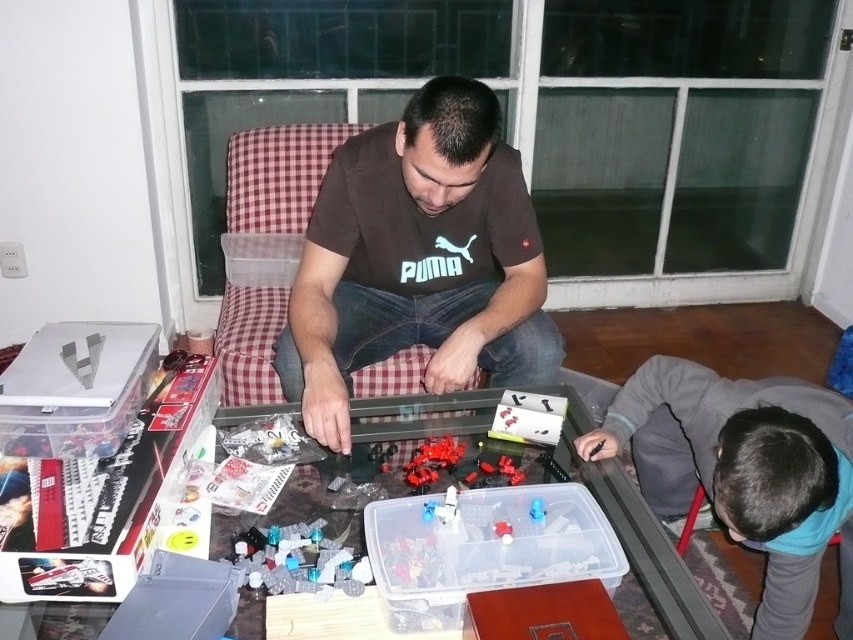
Looking at this image, you are standing in front of the coffee table and want to place a small LEGO piece on the table. You have two points to choose from, point A at coordinates point (376, 291) and point B at coordinates point (277, 534). Which point is closer to you?

Point A at coordinates point (376, 291) is closer to you because it is further to the viewer than point B at coordinates point (277, 534).

You are a photographer trying to capture a closeup of the LEGO pieces on the table. The brown cotton shirt at center and the gray fleece jacket at lower right are blocking your view. Which clothing item do you need to move to get a clear shot of the table?

The brown cotton shirt at center is wider than the gray fleece jacket at lower right, so you should move the brown cotton shirt at center to get a clear view of the table.